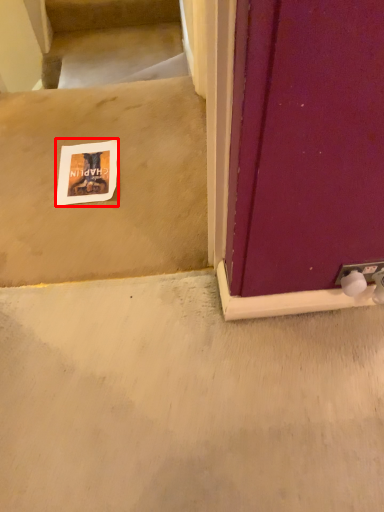
Question: From the image's perspective, what is the correct spatial positioning of postcard (annotated by the red box) in reference to stairwell?

Choices:
 (A) above
 (B) below

Answer: (B)